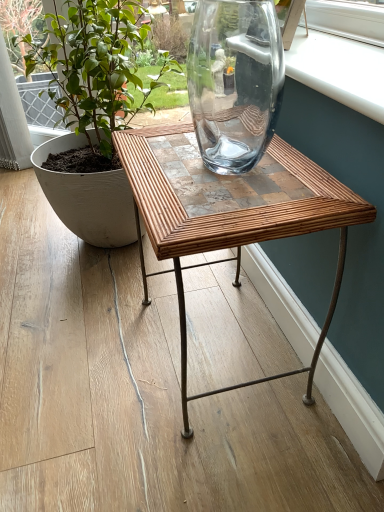
Find the location of a particular element. empty space that is in between green matte plant at left and bamboowoodentable at center is located at coordinates (124, 302).